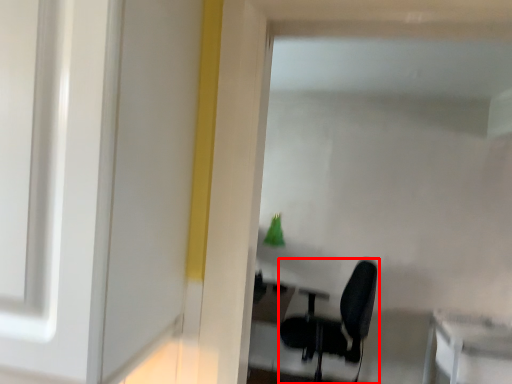
Question: From the image's perspective, where is chair (annotated by the red box) located relative to table?

Choices:
 (A) above
 (B) below

Answer: (A)